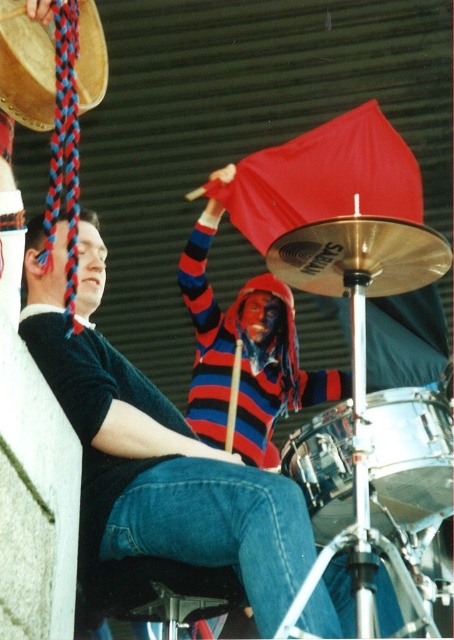
Question: In this image, where is striped sweater at center located relative to striped wool sweater at center?

Choices:
 (A) right
 (B) left

Answer: (B)

Question: Does striped wool sweater at center appear under shiny silver drum at center?

Choices:
 (A) no
 (B) yes

Answer: (A)

Question: Is shiny silver drum at center positioned in front of wooden drum at upper left?

Choices:
 (A) yes
 (B) no

Answer: (A)

Question: Which point appears closest to the camera in this image?

Choices:
 (A) click(x=8, y=10)
 (B) click(x=281, y=300)
 (C) click(x=97, y=442)
 (D) click(x=305, y=426)

Answer: (D)

Question: Which of these objects is positioned closest to the wooden drum at upper left?

Choices:
 (A) striped sweater at center
 (B) denim at left
 (C) shiny silver drum at center

Answer: (A)

Question: Based on their relative distances, which object is farther from the denim at left?

Choices:
 (A) shiny silver drum at center
 (B) striped wool sweater at center

Answer: (B)